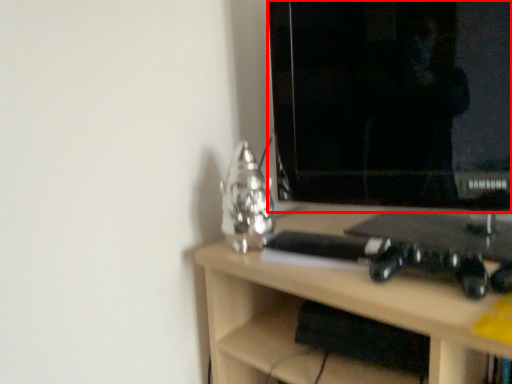
Question: From the image's perspective, what is the correct spatial positioning of computer monitor (annotated by the red box) in reference to desk?

Choices:
 (A) below
 (B) above

Answer: (B)